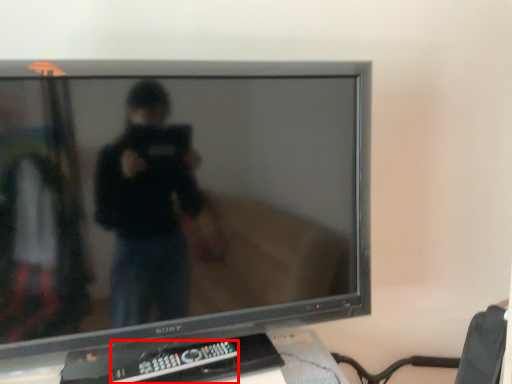
Question: Where is remote control (annotated by the red box) located in relation to television in the image?

Choices:
 (A) left
 (B) right

Answer: (A)